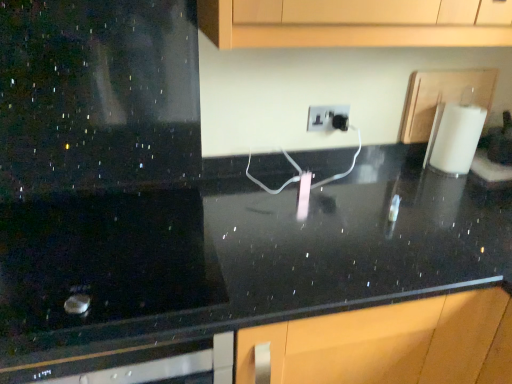
Question: Considering their positions, is white matte paper towel at right located in front of or behind black polished countertop at center?

Choices:
 (A) front
 (B) behind

Answer: (B)

Question: From a real-world perspective, is white matte paper towel at right positioned above or below black polished countertop at center?

Choices:
 (A) above
 (B) below

Answer: (A)

Question: Estimate the real-world distances between objects in this image. Which object is closer to the white matte paper towel at right?

Choices:
 (A) black polished countertop at center
 (B) white plastic electric outlet at center

Answer: (B)

Question: Which object is positioned closest to the white plastic electric outlet at center?

Choices:
 (A) white matte paper towel at right
 (B) black polished countertop at center

Answer: (A)